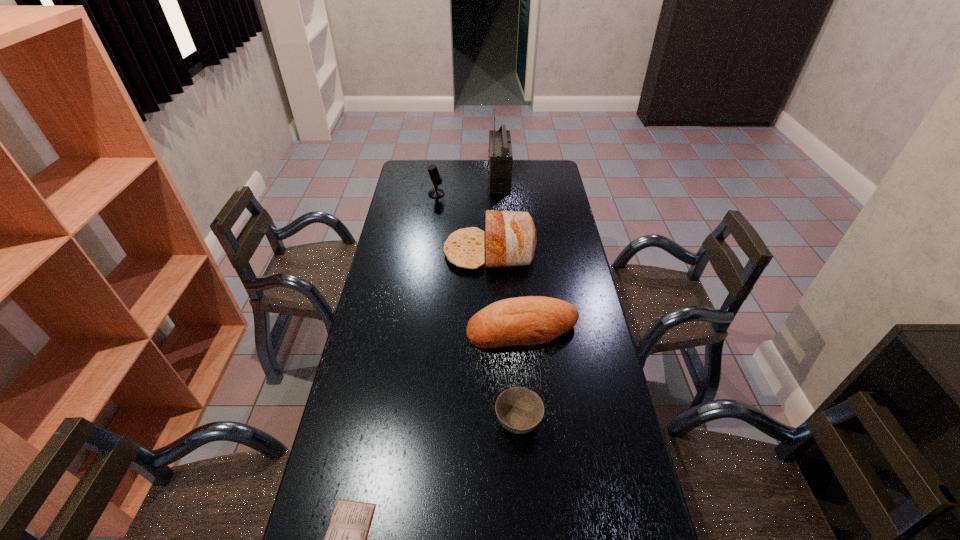
The height and width of the screenshot is (540, 960). In order to click on vacant area situated 0.080m on the front panel of the radio receiver in this screenshot , I will do `click(472, 179)`.

Identify the location of vacant space situated at the sliced end of the taller bread. (403, 252).

Locate an element on the screen. Image resolution: width=960 pixels, height=540 pixels. free space located 0.110m at the sliced end of the taller bread is located at coordinates (418, 252).

At what (x,y) coordinates should I click in order to perform the action: click on vacant space situated on the stand of the fifth object from right to left. Please return your answer as a coordinate pair (x, y). This screenshot has width=960, height=540. Looking at the image, I should click on pyautogui.click(x=527, y=194).

The image size is (960, 540). Identify the location of vacant region located 0.360m on the front of the fourth tallest object. (535, 458).

The image size is (960, 540). Find the location of `vacant space located 0.200m on the right of the fifth farthest object`. vacant space located 0.200m on the right of the fifth farthest object is located at coordinates (612, 422).

Identify the location of object positioned at the far edge. The image size is (960, 540). (500, 155).

What are the coordinates of `object that is at the left edge` in the screenshot? It's located at (436, 178).

This screenshot has width=960, height=540. What are the coordinates of `object present at the right edge` in the screenshot? It's located at (532, 320).

Where is `vacant space at the left edge of the desktop`? vacant space at the left edge of the desktop is located at coordinates (405, 271).